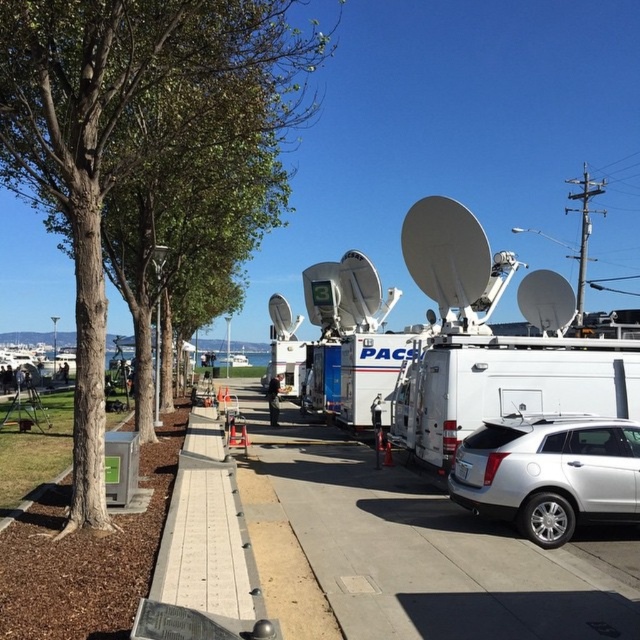
You are a pedestrian walking along the gray concrete sidewalk at center and want to reach the green leafy tree at center. Which direction should you walk to get there?

The green leafy tree at center is positioned on the left side of gray concrete sidewalk at center, so you should walk to the left to reach it.

You are standing at the starting point of the sidewalk. You need to walk to the green leafy tree at center. Which direction should you walk?

The green leafy tree at center is located at point [124,132]. Since the coordinates are in the center, you should walk straight ahead along the sidewalk to reach it.